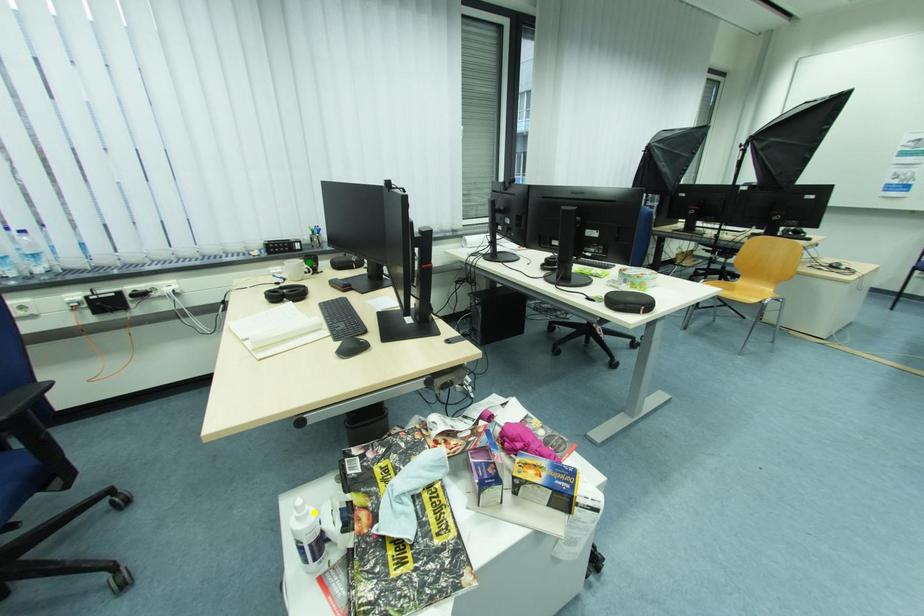
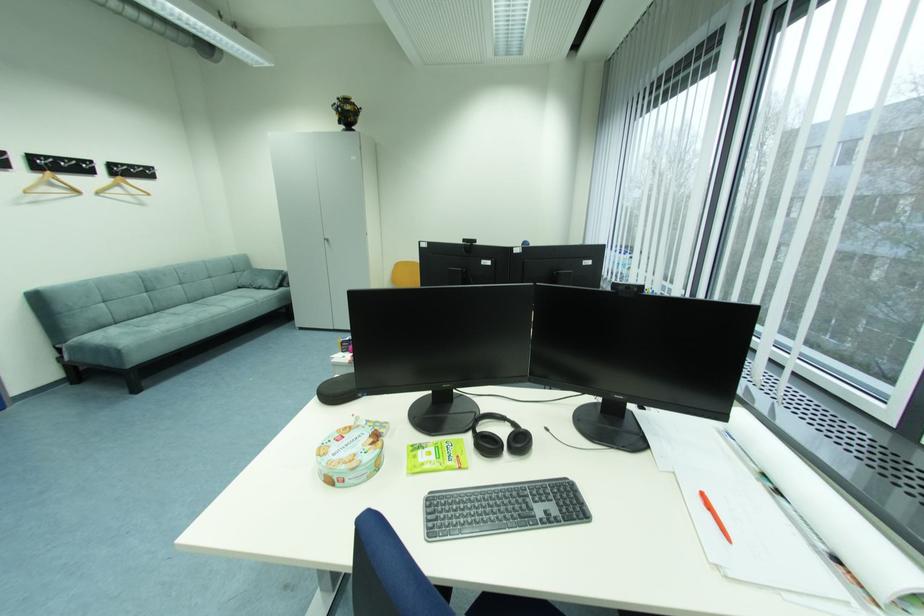
I am providing you with two images of the same scene from different viewpoints. Three points are marked in image1. Which point corresponds to a part or object that is occluded in image2?In image1, three points are marked. Which of them correspond to a part or object that is occluded in image2?Among the three points shown in image1, which one corresponds to a part or object that is no longer visible due to occlusion in image2?

blue point, yellow point, green point